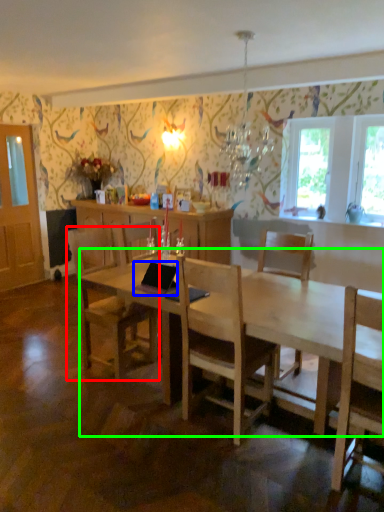
Question: Estimate the real-world distances between objects in this image. Which object is closer to chair (highlighted by a red box), laptop (highlighted by a blue box) or desk (highlighted by a green box)?

Choices:
 (A) laptop
 (B) desk

Answer: (A)